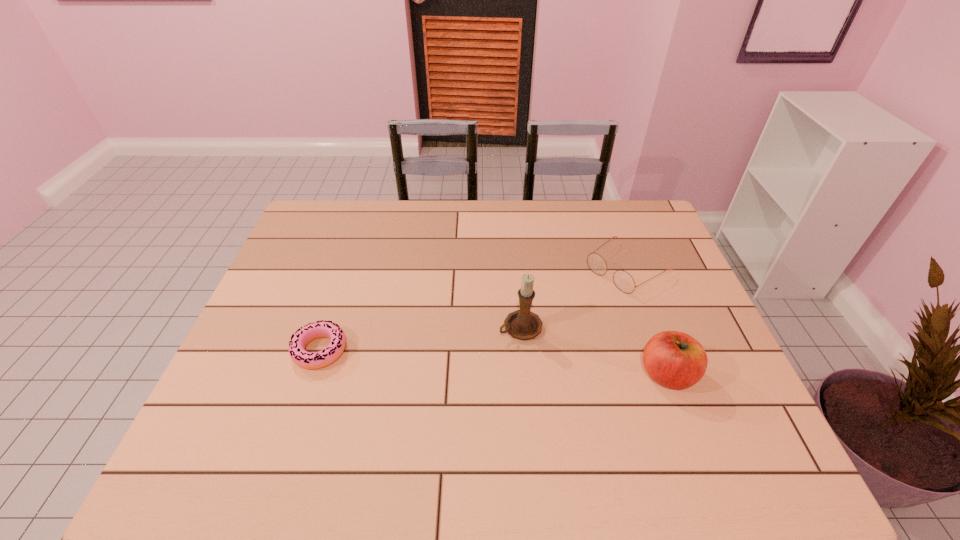
This screenshot has width=960, height=540. In order to click on the shortest object in this screenshot , I will do `click(309, 360)`.

Where is `the leftmost object`? the leftmost object is located at coordinates pos(309,360).

Where is `the second tallest object`? The image size is (960, 540). the second tallest object is located at coordinates click(674, 359).

The width and height of the screenshot is (960, 540). Identify the location of the third tallest object. (624, 282).

Find the location of `the farthest object`. the farthest object is located at coordinates pos(624,282).

The width and height of the screenshot is (960, 540). Find the location of `candle holder`. candle holder is located at coordinates (523, 324).

The height and width of the screenshot is (540, 960). Identify the location of the tallest object. (523, 324).

This screenshot has height=540, width=960. I want to click on free space located on the front of the doughnut, so click(x=295, y=426).

This screenshot has width=960, height=540. In order to click on free space located 0.330m on the left of the apple in this screenshot , I will do `click(503, 375)`.

Locate an element on the screen. Image resolution: width=960 pixels, height=540 pixels. free location located 0.350m on the temples of the spectacles is located at coordinates (512, 347).